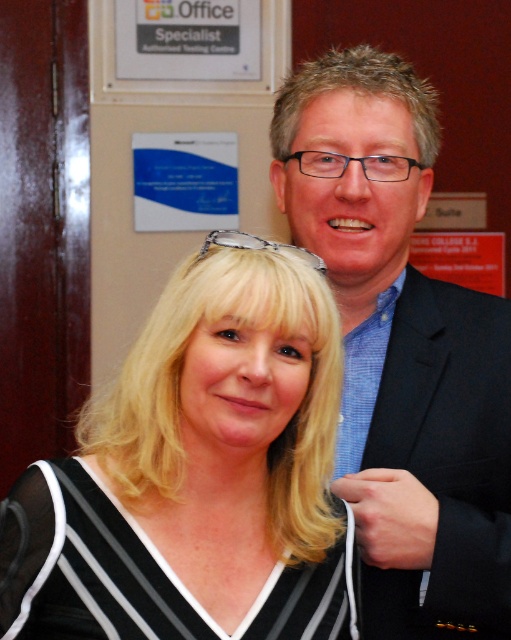
I want to click on black striped blouse at center, so click(x=198, y=476).

Can you confirm if black striped blouse at center is positioned above black striped fabric dress at center?

Yes.

The height and width of the screenshot is (640, 511). What do you see at coordinates (198, 476) in the screenshot?
I see `black striped blouse at center` at bounding box center [198, 476].

You are a GUI agent. You are given a task and a screenshot of the screen. Output one action in this format:
    pyautogui.click(x=<x>, y=<y>)
    Task: Click on the black striped blouse at center
    
    Given the screenshot: What is the action you would take?
    pyautogui.click(x=198, y=476)

Which is behind, point (408, 432) or point (178, 602)?

The point (408, 432) is more distant.

In the scene shown: Can you confirm if black textured suit at upper right is positioned above black striped fabric dress at center?

Yes, black textured suit at upper right is above black striped fabric dress at center.

Describe the element at coordinates (402, 349) in the screenshot. This screenshot has width=511, height=640. I see `black textured suit at upper right` at that location.

Locate an element on the screen. black textured suit at upper right is located at coordinates (402, 349).

Who is shorter, black striped blouse at center or black textured suit at upper right?

black striped blouse at center

Does black striped blouse at center lie in front of black textured suit at upper right?

Yes, black striped blouse at center is closer to the viewer.

You are a GUI agent. You are given a task and a screenshot of the screen. Output one action in this format:
    pyautogui.click(x=<x>, y=<y>)
    Task: Click on the black striped blouse at center
    
    Given the screenshot: What is the action you would take?
    pyautogui.click(x=198, y=476)